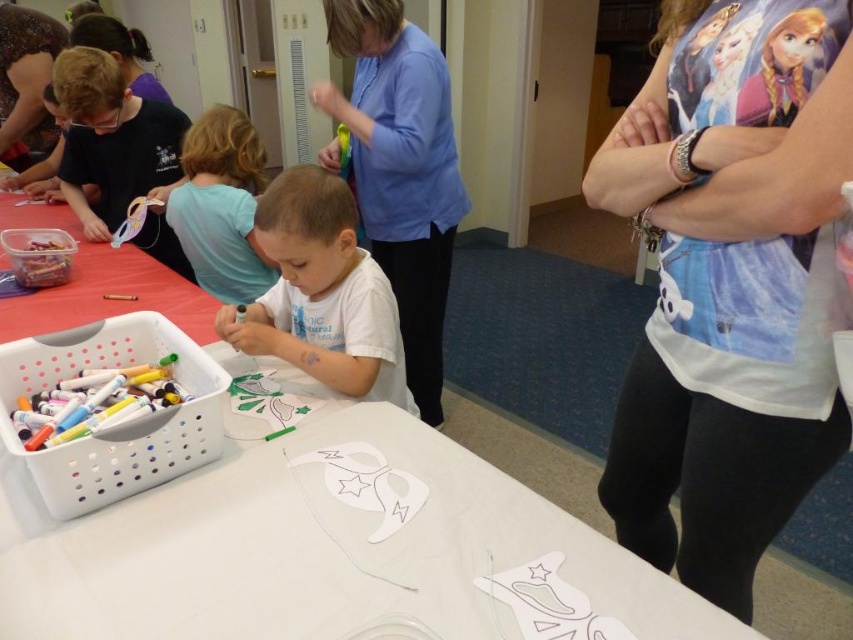
You are a visitor in the community center and want to find the white paper table at center. Where should you look relative to the light blue shirt at upper left?

The white paper table at center is located below the light blue shirt at upper left, so you should look downward from the light blue shirt at upper left to find it.

You are standing in the room and see the white printed shirt at upper right and the white paper table at center. Which object is positioned higher relative to the other?

The white printed shirt at upper right is located above the white paper table at center, so it is positioned higher.

You are a visitor in the room and want to know if the white printed shirt at upper right can be placed on the white paper table at center without falling off. Can it fit?

The white printed shirt at upper right is taller than white paper table at center, so it may not fit properly and could potentially fall off.